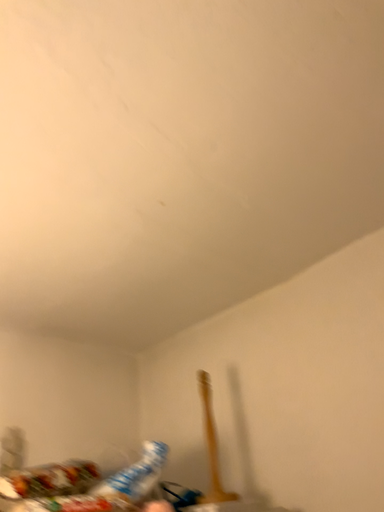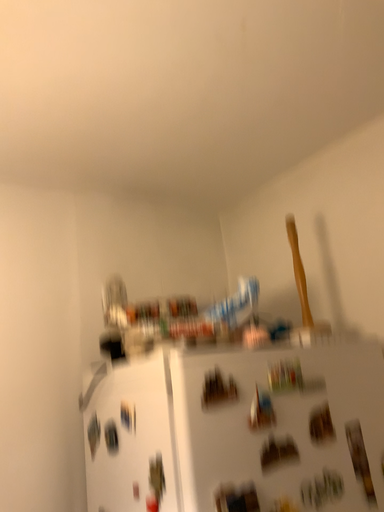
Question: How did the camera likely rotate when shooting the video?

Choices:
 (A) rotated right
 (B) rotated left

Answer: (B)